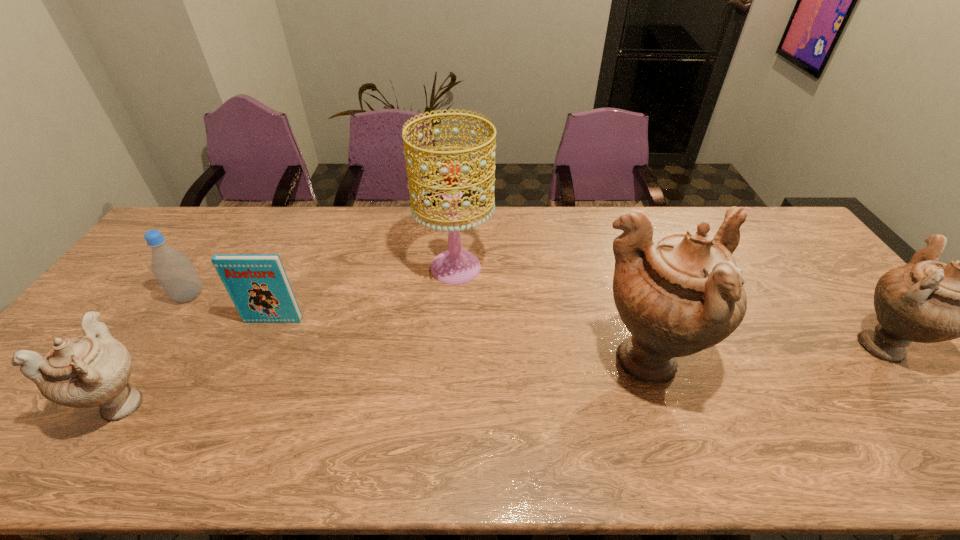
Where is `vacant region between the shortest urn and the third object from left to right`? The width and height of the screenshot is (960, 540). vacant region between the shortest urn and the third object from left to right is located at coordinates (199, 361).

This screenshot has height=540, width=960. In order to click on free spot between the fourth object from left to right and the bottle in this screenshot , I will do `click(323, 281)`.

The height and width of the screenshot is (540, 960). I want to click on vacant space in between the bottle and the third object from left to right, so click(x=231, y=308).

In order to click on free space between the second urn from left to right and the book in this screenshot , I will do `click(460, 341)`.

In order to click on free point between the bottle and the book in this screenshot , I will do 231,308.

I want to click on free space that is in between the lampshade and the fifth object from left to right, so tap(551, 315).

In order to click on free point between the third object from right to left and the bottle in this screenshot , I will do `click(323, 281)`.

Find the location of a particular element. vacant region between the bottle and the fourth shortest object is located at coordinates (535, 320).

Where is `free space between the lampshade and the second urn from left to right`? free space between the lampshade and the second urn from left to right is located at coordinates (551, 315).

Locate an element on the screen. This screenshot has width=960, height=540. free space between the leftmost urn and the second urn from left to right is located at coordinates (385, 383).